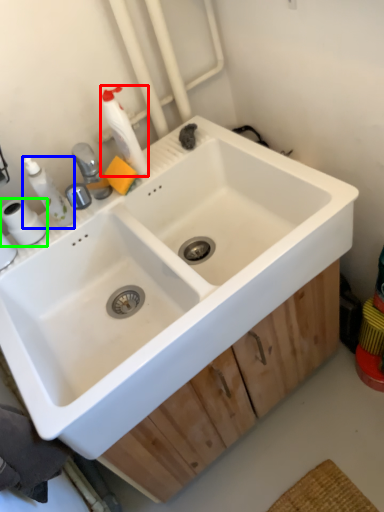
Question: Considering the real-world distances, which object is farthest from cleaning product (highlighted by a red box)? toiletry (highlighted by a blue box) or toilet paper (highlighted by a green box)?

Choices:
 (A) toiletry
 (B) toilet paper

Answer: (B)